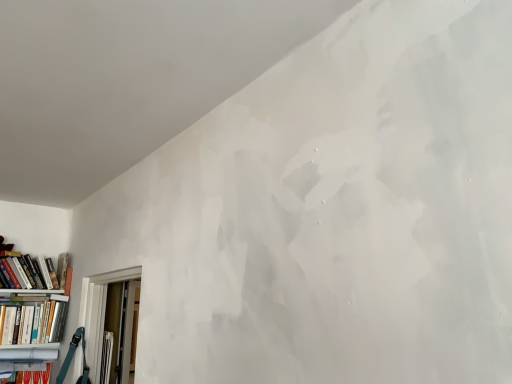
Question: Is hardcover book at left, arranged as the first book when ordered from the bottom, closer to the viewer compared to matte white bookcase at lower left?

Choices:
 (A) no
 (B) yes

Answer: (A)

Question: From the image's perspective, is hardcover book at left, placed as the 2th book when sorted from top to bottom, above matte white bookcase at lower left?

Choices:
 (A) yes
 (B) no

Answer: (A)

Question: Is hardcover book at left, placed as the 2th book when sorted from top to bottom, located outside matte white bookcase at lower left?

Choices:
 (A) yes
 (B) no

Answer: (B)

Question: Can you confirm if hardcover book at left, arranged as the first book when ordered from the bottom, is taller than matte white bookcase at lower left?

Choices:
 (A) yes
 (B) no

Answer: (B)

Question: From the image's perspective, is hardcover book at left, arranged as the first book when ordered from the bottom, below matte white bookcase at lower left?

Choices:
 (A) no
 (B) yes

Answer: (A)

Question: Relative to hardcover book at left, placed as the 2th book when sorted from top to bottom, is matte white bookcase at lower left in front or behind?

Choices:
 (A) behind
 (B) front

Answer: (B)

Question: Is point (51, 334) closer or farther from the camera than point (24, 337)?

Choices:
 (A) farther
 (B) closer

Answer: (A)

Question: Considering the positions of matte white bookcase at lower left and hardcover book at left, placed as the 2th book when sorted from top to bottom, in the image, is matte white bookcase at lower left taller or shorter than hardcover book at left, placed as the 2th book when sorted from top to bottom,?

Choices:
 (A) tall
 (B) short

Answer: (A)

Question: Is matte white bookcase at lower left inside or outside of hardcover book at left, arranged as the first book when ordered from the bottom?

Choices:
 (A) inside
 (B) outside

Answer: (A)

Question: Relative to hardcover book at left, the 1th book positioned from the top, is matte white bookcase at lower left in front or behind?

Choices:
 (A) behind
 (B) front

Answer: (B)

Question: Considering the positions of matte white bookcase at lower left and hardcover book at left, the 2th book ordered from the bottom, in the image, is matte white bookcase at lower left bigger or smaller than hardcover book at left, the 2th book ordered from the bottom,?

Choices:
 (A) small
 (B) big

Answer: (B)

Question: Do you think matte white bookcase at lower left is within hardcover book at left, the 1th book positioned from the top, or outside of it?

Choices:
 (A) outside
 (B) inside

Answer: (A)

Question: From the image's perspective, is matte white bookcase at lower left above or below hardcover book at left, the 2th book ordered from the bottom?

Choices:
 (A) below
 (B) above

Answer: (A)

Question: From their relative heights in the image, would you say hardcover book at left, the 1th book positioned from the top, is taller or shorter than matte white bookcase at lower left?

Choices:
 (A) short
 (B) tall

Answer: (A)

Question: Looking at the image, does hardcover book at left, the 2th book ordered from the bottom, seem bigger or smaller compared to matte white bookcase at lower left?

Choices:
 (A) big
 (B) small

Answer: (B)